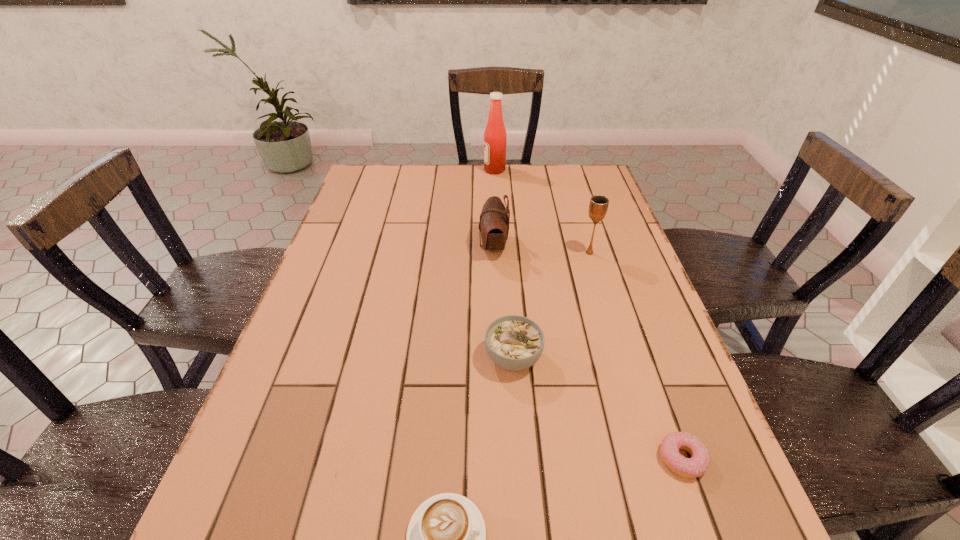
Where is `vacant region at the far edge of the desktop`? vacant region at the far edge of the desktop is located at coordinates (409, 190).

The image size is (960, 540). What are the coordinates of `vacant space at the left edge of the desktop` in the screenshot? It's located at (334, 401).

The width and height of the screenshot is (960, 540). What are the coordinates of `blank space at the right edge of the desktop` in the screenshot? It's located at (654, 450).

The height and width of the screenshot is (540, 960). In the image, there is a desktop. Find the location of `vacant space at the far left corner`. vacant space at the far left corner is located at coordinates (361, 187).

Where is `vacant point located between the second tallest object and the condiment`? The width and height of the screenshot is (960, 540). vacant point located between the second tallest object and the condiment is located at coordinates (542, 211).

Identify the location of vacant area that lies between the pouch and the soup bowl. (503, 302).

Where is `free space between the third nearest object and the second tallest object`? The image size is (960, 540). free space between the third nearest object and the second tallest object is located at coordinates (551, 305).

Where is `unoccupied area between the farthest object and the soup bowl`? The image size is (960, 540). unoccupied area between the farthest object and the soup bowl is located at coordinates tap(504, 264).

This screenshot has width=960, height=540. I want to click on vacant area that lies between the soup bowl and the condiment, so click(x=504, y=264).

I want to click on unoccupied area between the third nearest object and the second tallest object, so click(x=551, y=305).